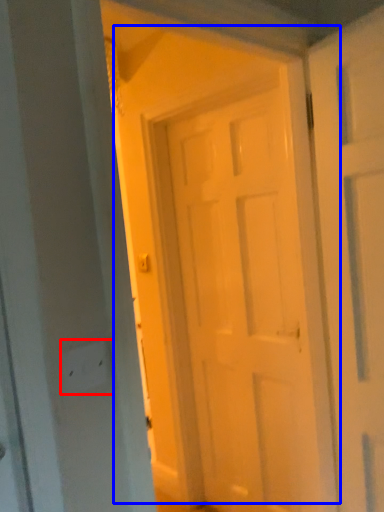
Question: Among these objects, which one is farthest to the camera, electric outlet (highlighted by a red box) or door (highlighted by a blue box)?

Choices:
 (A) electric outlet
 (B) door

Answer: (B)